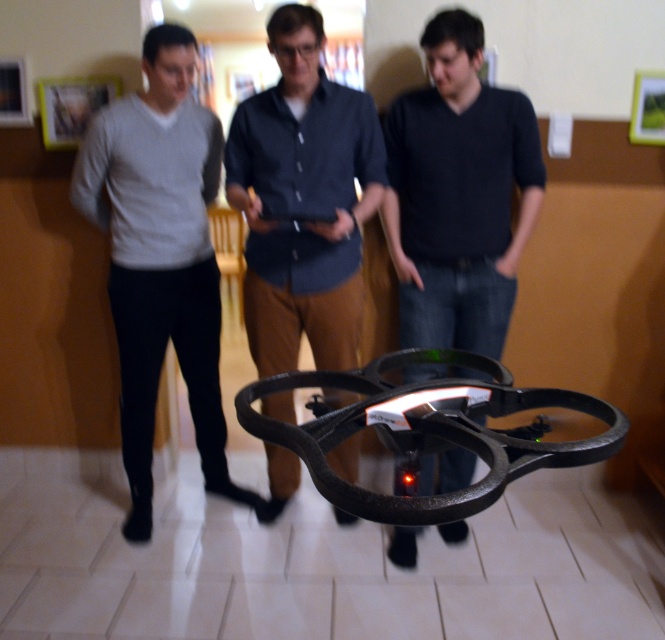
Based on the photo, can you confirm if dark gray sweater at center is wider than dark blue shirt at center?

Yes, dark gray sweater at center is wider than dark blue shirt at center.

Is dark gray sweater at center below dark blue shirt at center?

Actually, dark gray sweater at center is above dark blue shirt at center.

The height and width of the screenshot is (640, 665). Identify the location of dark gray sweater at center. (458, 193).

Which of these two, matte gray sweater at left or dark blue shirt at center, stands taller?

matte gray sweater at left is taller.

Is matte gray sweater at left to the left of dark blue shirt at center from the viewer's perspective?

Indeed, matte gray sweater at left is positioned on the left side of dark blue shirt at center.

Does point (120, 220) lie in front of point (354, 273)?

Yes, it is.

Locate an element on the screen. This screenshot has width=665, height=640. matte gray sweater at left is located at coordinates (160, 257).

Can you confirm if matte gray sweater at left is smaller than dark gray sweater at center?

No.

Who is more distant from viewer, (x=166, y=147) or (x=402, y=300)?

Positioned behind is point (x=402, y=300).

The height and width of the screenshot is (640, 665). I want to click on matte gray sweater at left, so click(x=160, y=257).